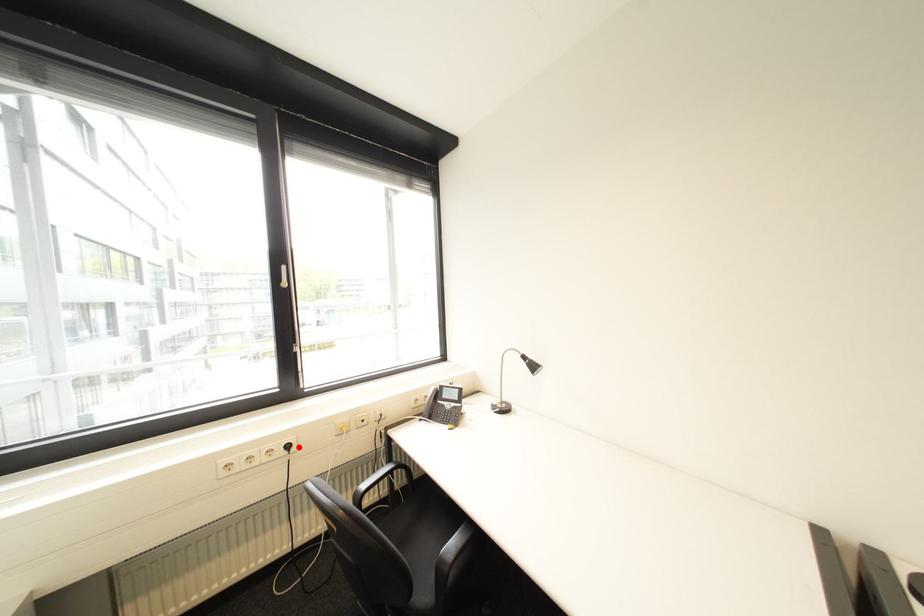
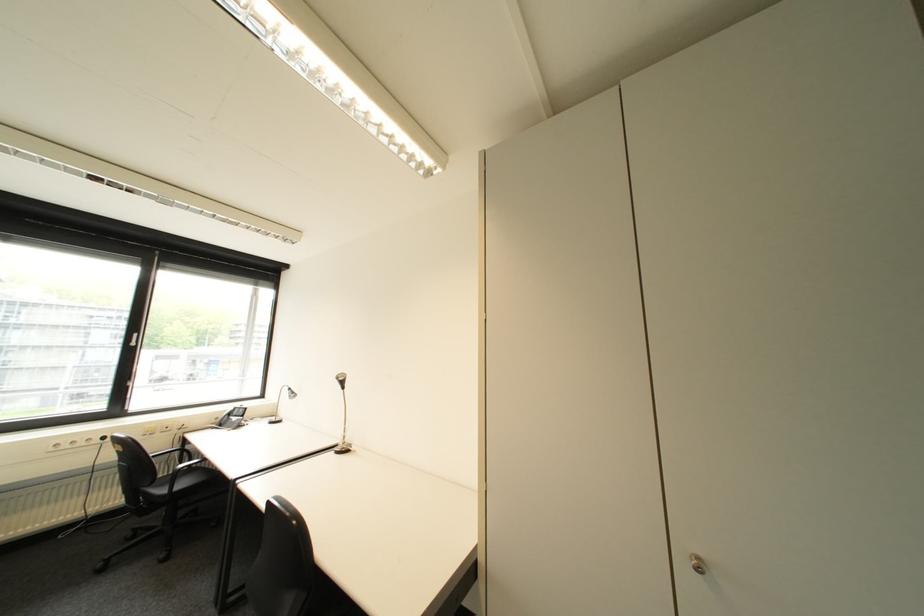
Locate, in the second image, the point that corresponds to the highlighted location in the first image.

(114, 439)